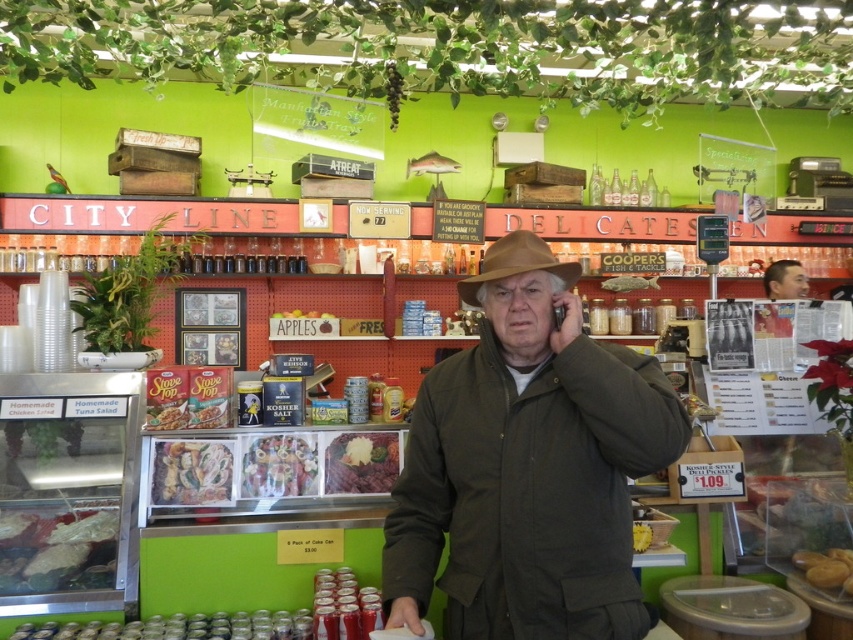
Question: Among these points, which one is farthest from the camera?

Choices:
 (A) (525, 260)
 (B) (648, 531)
 (C) (808, 561)

Answer: (C)

Question: Does dark brown corduroy jacket at center have a lesser width compared to green matte apples at center?

Choices:
 (A) yes
 (B) no

Answer: (B)

Question: Based on their relative distances, which object is nearer to the matte plastic slope top at center?

Choices:
 (A) yellow matte bread at lower right
 (B) yellow crumbly pastry at center

Answer: (B)

Question: Which point is farther from the camera taking this photo?

Choices:
 (A) (189, 484)
 (B) (647, 545)

Answer: (A)

Question: Can you confirm if dark brown corduroy jacket at center is positioned to the right of shiny plastic food at center?

Choices:
 (A) no
 (B) yes

Answer: (B)

Question: Can you confirm if yellow matte bread at lower right is bigger than yellow crumbly pastry at center?

Choices:
 (A) yes
 (B) no

Answer: (A)